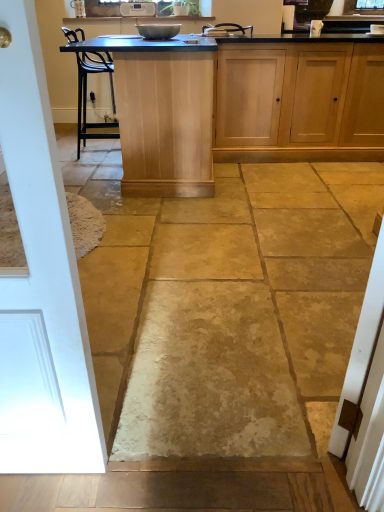
Identify the location of white painted wood door at left. The height and width of the screenshot is (512, 384). [x=41, y=283].

Does metallic bowl at center turn towards light wood table at center?

No, metallic bowl at center is not facing towards light wood table at center.

Which point is more distant from viewer, (162, 24) or (130, 61)?

The point (162, 24) is more distant.

From a real-world perspective, is metallic bowl at center positioned above or below light wood table at center?

Clearly, from a real-world perspective, metallic bowl at center is above light wood table at center.

How different are the orientations of metallic bowl at center and light wood table at center in degrees?

The facing directions of metallic bowl at center and light wood table at center are 0.466 degrees apart.

Looking at their sizes, would you say metallic bowl at center is wider or thinner than light wood cabinet at center?

Considering their sizes, metallic bowl at center looks slimmer than light wood cabinet at center.

This screenshot has height=512, width=384. What are the coordinates of `cabinetry on the right of metallic bowl at center` in the screenshot? It's located at (299, 101).

From a real-world perspective, which object stands above the other?

metallic bowl at center.

Which is more to the right, light wood cabinet at center or metallic bowl at center?

Positioned to the right is light wood cabinet at center.

What's the angular difference between light wood cabinet at center and metallic bowl at center's facing directions?

The angular difference between light wood cabinet at center and metallic bowl at center is 87.4 degrees.

Can you confirm if light wood cabinet at center is wider than metallic bowl at center?

Correct, the width of light wood cabinet at center exceeds that of metallic bowl at center.

Which is behind, point (325, 50) or point (171, 27)?

The point (325, 50) is behind.

Find the location of a particular element. The image size is (384, 512). appliance behind the white painted wood door at left is located at coordinates (158, 30).

Between point (49, 374) and point (145, 36), which one is positioned behind?

The point (145, 36) is farther.

Looking at this image, in terms of width, does white painted wood door at left look wider or thinner when compared to metallic bowl at center?

Clearly, white painted wood door at left has less width compared to metallic bowl at center.

Is there a large distance between white painted wood door at left and metallic bowl at center?

white painted wood door at left is far away from metallic bowl at center.

Consider the image. Is light wood table at center taller or shorter than metallic bowl at center?

Clearly, light wood table at center is taller compared to metallic bowl at center.

From the picture: Which is nearer, (178, 139) or (168, 39)?

The point (178, 139) is in front.

Is light wood table at center thinner than metallic bowl at center?

No.

How many degrees apart are the facing directions of light wood table at center and metallic bowl at center?

0.466 degrees.

Considering the relative sizes of light wood table at center and white painted wood door at left in the image provided, is light wood table at center shorter than white painted wood door at left?

Correct, light wood table at center is not as tall as white painted wood door at left.

Is light wood table at center to the left of white painted wood door at left from the viewer's perspective?

Incorrect, light wood table at center is not on the left side of white painted wood door at left.

Would you consider light wood table at center to be distant from white painted wood door at left?

Yes.

Find the location of a particular element. The image size is (384, 512). cabinetry behind the light wood table at center is located at coordinates (299, 101).

From a real-world perspective, which is physically below, light wood cabinet at center or light wood table at center?

In real-world perspective, light wood cabinet at center is lower.

Which is in front, point (253, 140) or point (131, 152)?

The point (131, 152) is more forward.

In terms of size, does light wood cabinet at center appear bigger or smaller than light wood table at center?

In the image, light wood cabinet at center appears to be smaller than light wood table at center.

Where is `appliance above the light wood table at center (from the image's perspective)`? appliance above the light wood table at center (from the image's perspective) is located at coordinates (158, 30).

Locate an element on the screen. The width and height of the screenshot is (384, 512). appliance that is in front of the light wood cabinet at center is located at coordinates (158, 30).

Considering their positions, is white painted wood door at left positioned closer to light wood cabinet at center than metallic bowl at center?

metallic bowl at center lies closer to light wood cabinet at center than the other object.

From the image, which object appears to be nearer to white painted wood door at left, metallic bowl at center or light wood cabinet at center?

The object closer to white painted wood door at left is metallic bowl at center.

When comparing their distances from light wood table at center, does metallic bowl at center or light wood cabinet at center seem further?

Among the two, light wood cabinet at center is located further to light wood table at center.

Considering their positions, is white painted wood door at left positioned further to light wood cabinet at center than light wood table at center?

white painted wood door at left.

Which object lies further to the anchor point light wood cabinet at center, metallic bowl at center or light wood table at center?

metallic bowl at center.

Based on their spatial positions, is white painted wood door at left or light wood cabinet at center further from metallic bowl at center?

Among the two, white painted wood door at left is located further to metallic bowl at center.

From the image, which object appears to be nearer to metallic bowl at center, light wood table at center or white painted wood door at left?

light wood table at center is closer to metallic bowl at center.

When comparing their distances from light wood table at center, does light wood cabinet at center or white painted wood door at left seem closer?

light wood cabinet at center.

The width and height of the screenshot is (384, 512). Find the location of `table located between white painted wood door at left and light wood cabinet at center in the depth direction`. table located between white painted wood door at left and light wood cabinet at center in the depth direction is located at coordinates (162, 113).

Identify the location of table located between white painted wood door at left and metallic bowl at center in the depth direction. (162, 113).

You are a GUI agent. You are given a task and a screenshot of the screen. Output one action in this format:
    pyautogui.click(x=<x>, y=<y>)
    Task: Click on the appliance between white painted wood door at left and light wood cabinet at center from front to back
    The image size is (384, 512).
    Given the screenshot: What is the action you would take?
    pyautogui.click(x=158, y=30)

Where is `appliance situated between light wood table at center and light wood cabinet at center from left to right`? This screenshot has width=384, height=512. appliance situated between light wood table at center and light wood cabinet at center from left to right is located at coordinates (158, 30).